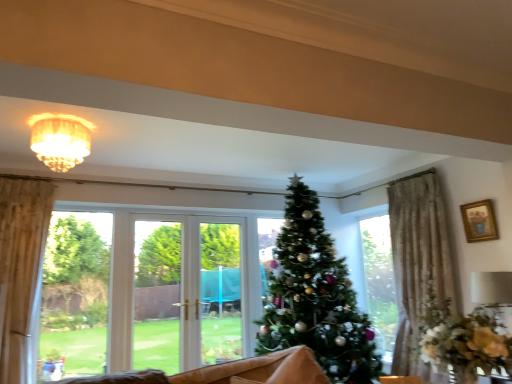
Question: Is wooden coffee table at lower center in front of gold-framed picture at upper right?

Choices:
 (A) yes
 (B) no

Answer: (A)

Question: Considering the relative positions of wooden coffee table at lower center and gold-framed picture at upper right in the image provided, is wooden coffee table at lower center to the right of gold-framed picture at upper right from the viewer's perspective?

Choices:
 (A) no
 (B) yes

Answer: (A)

Question: From a real-world perspective, does wooden coffee table at lower center stand above gold-framed picture at upper right?

Choices:
 (A) yes
 (B) no

Answer: (B)

Question: Could gold-framed picture at upper right be considered to be inside wooden coffee table at lower center?

Choices:
 (A) no
 (B) yes

Answer: (A)

Question: Is wooden coffee table at lower center turned away from gold-framed picture at upper right?

Choices:
 (A) yes
 (B) no

Answer: (B)

Question: Relative to matte gold chandelier at upper center, is gold-framed picture at upper right in front or behind?

Choices:
 (A) behind
 (B) front

Answer: (A)

Question: Is gold-framed picture at upper right wider or thinner than matte gold chandelier at upper center?

Choices:
 (A) wide
 (B) thin

Answer: (B)

Question: From their relative heights in the image, would you say gold-framed picture at upper right is taller or shorter than matte gold chandelier at upper center?

Choices:
 (A) tall
 (B) short

Answer: (B)

Question: Considering the positions of gold-framed picture at upper right and matte gold chandelier at upper center in the image, is gold-framed picture at upper right bigger or smaller than matte gold chandelier at upper center?

Choices:
 (A) small
 (B) big

Answer: (A)

Question: Is wooden coffee table at lower center wider or thinner than matte gold chandelier at upper center?

Choices:
 (A) thin
 (B) wide

Answer: (A)

Question: In the image, is wooden coffee table at lower center positioned in front of or behind matte gold chandelier at upper center?

Choices:
 (A) behind
 (B) front

Answer: (B)

Question: Is wooden coffee table at lower center inside the boundaries of matte gold chandelier at upper center, or outside?

Choices:
 (A) inside
 (B) outside

Answer: (B)

Question: From the image's perspective, relative to matte gold chandelier at upper center, is wooden coffee table at lower center above or below?

Choices:
 (A) above
 (B) below

Answer: (B)

Question: In terms of width, does gold-framed picture at upper right look wider or thinner when compared to green matte christmas tree at center?

Choices:
 (A) wide
 (B) thin

Answer: (B)

Question: From the image's perspective, is gold-framed picture at upper right located above or below green matte christmas tree at center?

Choices:
 (A) below
 (B) above

Answer: (B)